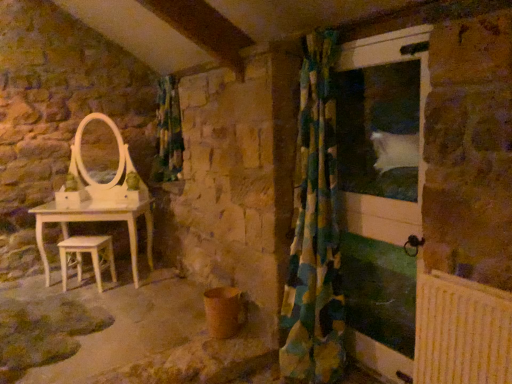
The width and height of the screenshot is (512, 384). I want to click on free space above white glossy screen door at right (from a real-world perspective), so click(377, 45).